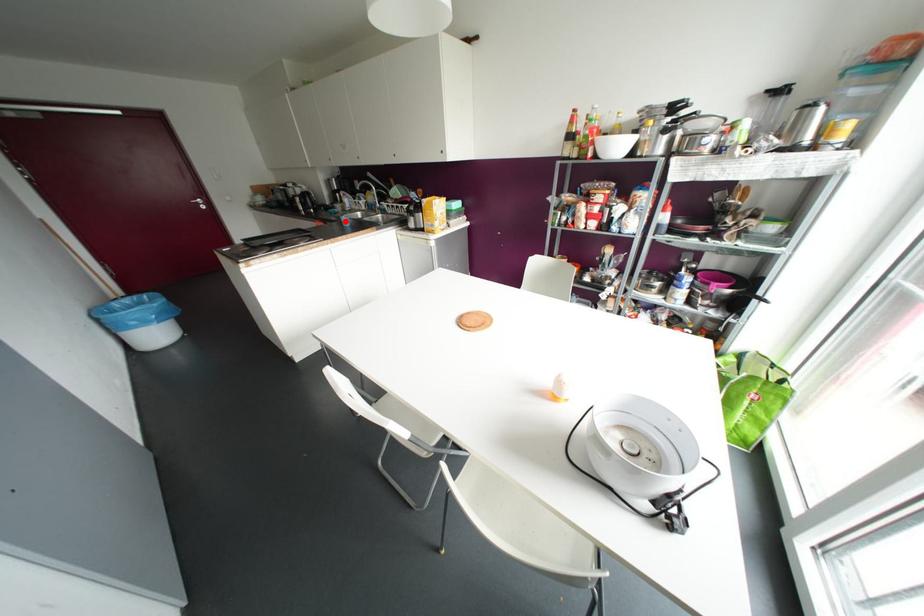
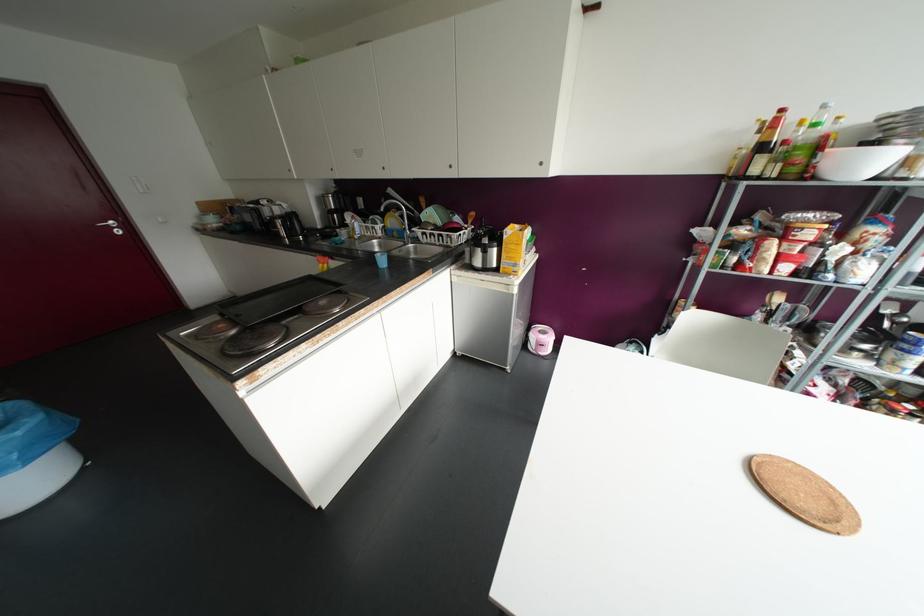
Question: I am providing you with two images of the same scene from different viewpoints. Given a red point in image1, look at the same physical point in image2. Is it:

Choices:
 (A) Closer to the viewpoint
 (B) Farther from the viewpoint

Answer: (A)